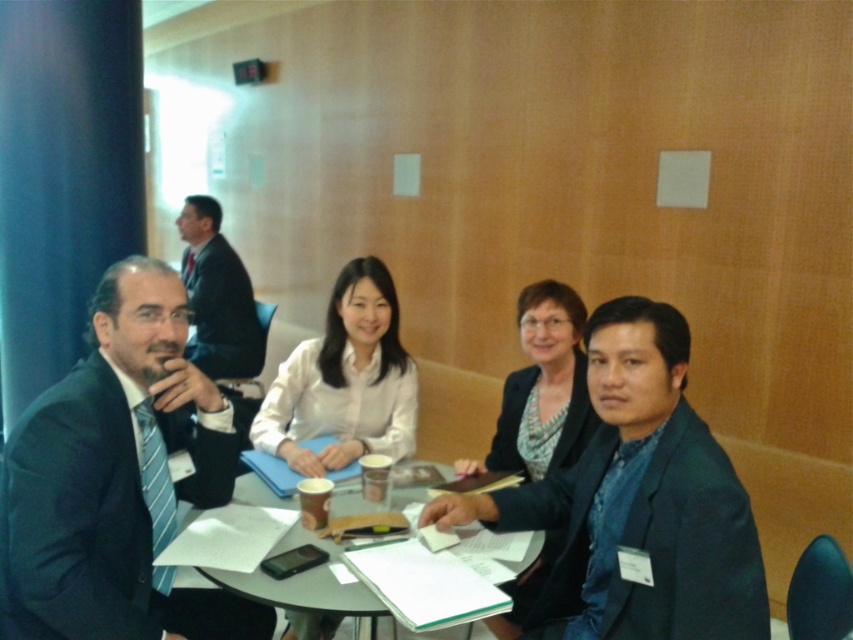
You are organizing a photoshoot and need to know if the matte black suit at center can be fully visible next to the matte black blazer at center in the same frame. Based on their sizes, will they both fit without overlapping?

The matte black suit at center might be wider than matte black blazer at center, so there is a possibility they may overlap if placed too close together. Ensure sufficient space between them to avoid overlap.

You are a photographer in a meeting room and you need to take a picture of the two people wearing the matte black suit at center and matte black blazer at center. Since they are both at the center, can you tell me which one is positioned to the left?

The matte black suit at center is to the left of the matte black blazer at center, so the person wearing the matte black suit at center is positioned to the left.

You are a professional photographer preparing to take a group photo of the individuals seated around the round table. You notice two people wearing a matte black suit at center and a patterned fabric blazer at center. To ensure both are visible in the frame, which person should you position closer to the camera to avoid being obscured by others?

The matte black suit at center might be wider than the patterned fabric blazer at center, so positioning the person in the matte black suit at center closer to the camera would help ensure both are visible without obstruction.